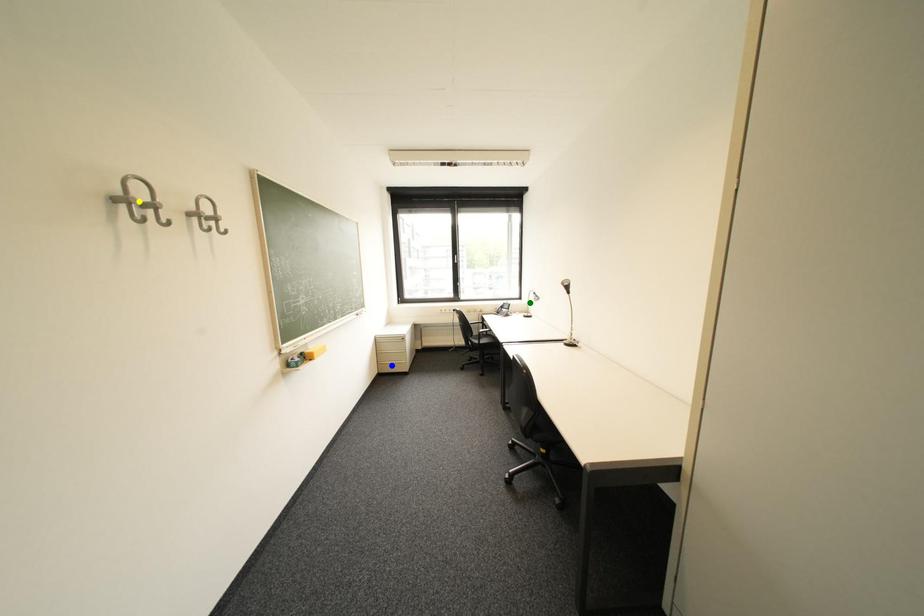
Order these from nearest to farthest:
1. blue point
2. yellow point
3. green point

blue point < green point < yellow point